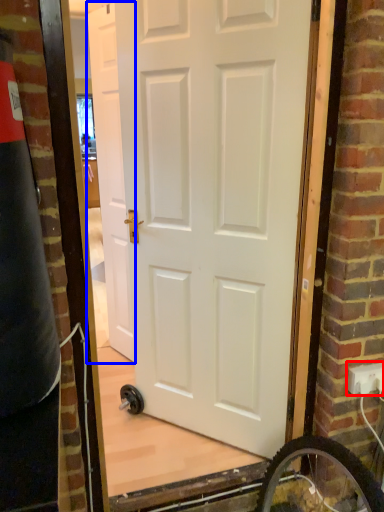
Question: Among these objects, which one is nearest to the camera, electric outlet (highlighted by a red box) or door (highlighted by a blue box)?

Choices:
 (A) electric outlet
 (B) door

Answer: (A)